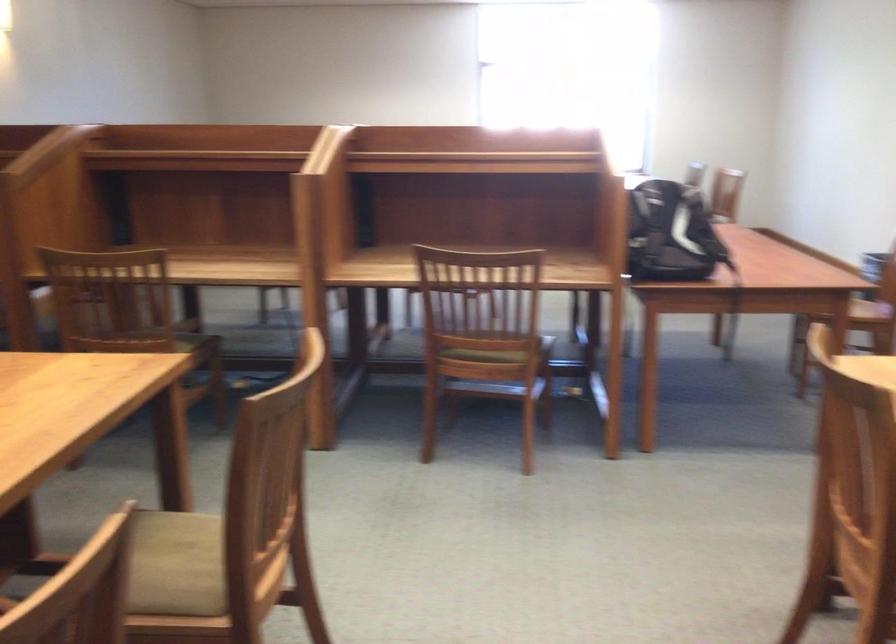
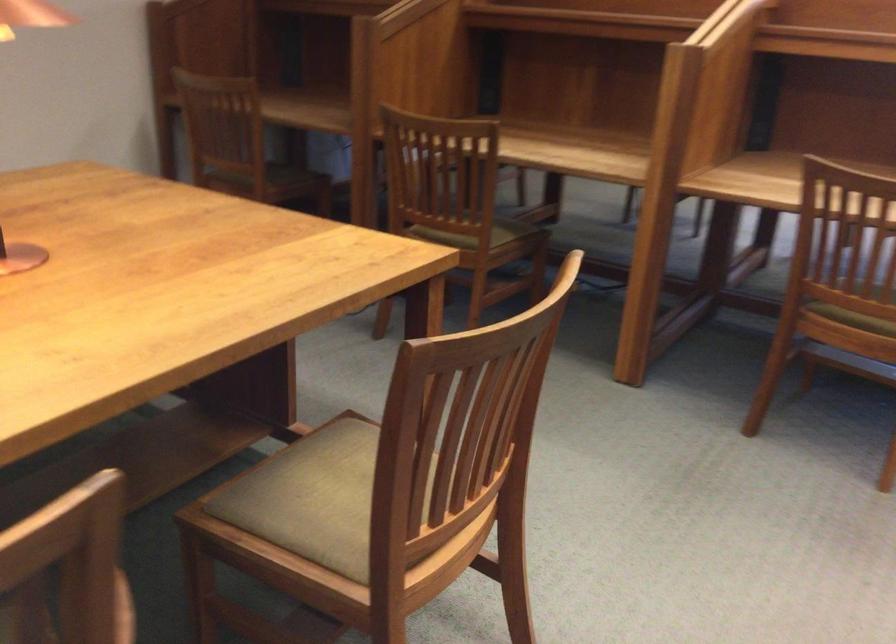
The point at (471, 355) is marked in the first image. Where is the corresponding point in the second image?

(855, 313)